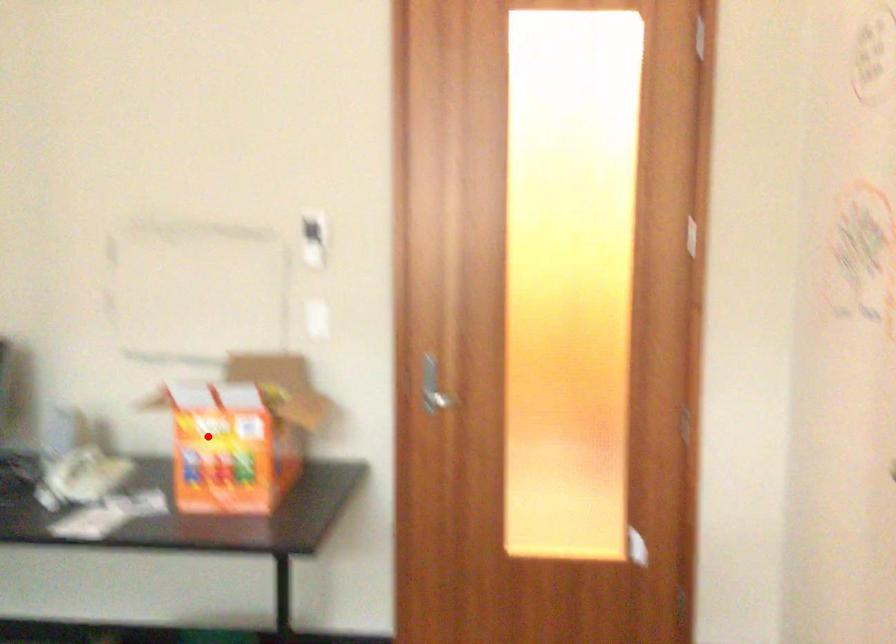
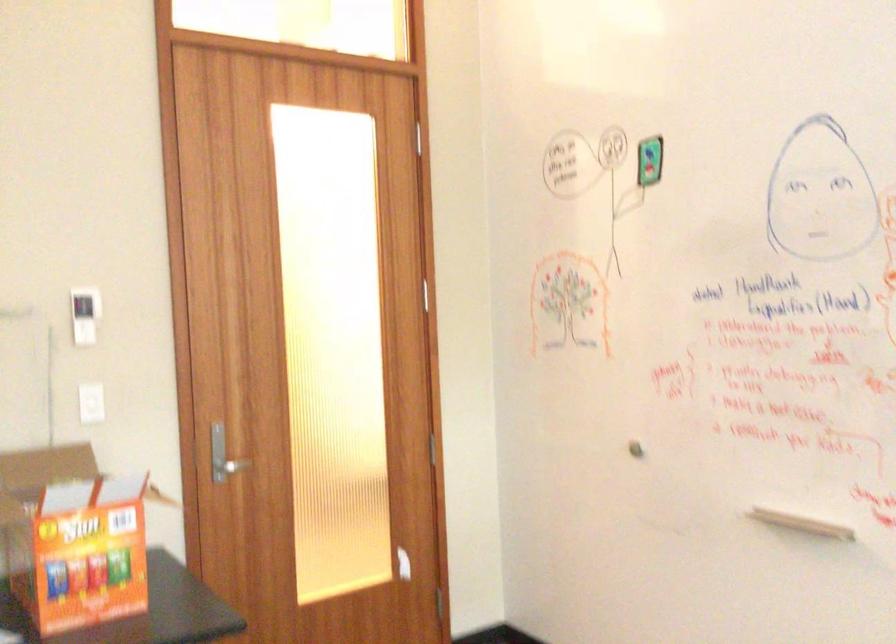
Question: A red point is marked in image1. In image2, is the corresponding 3D point closer to the camera or farther? Reply with the corresponding letter.

Choices:
 (A) The corresponding 3D point is closer.
 (B) The corresponding 3D point is farther.

Answer: (A)